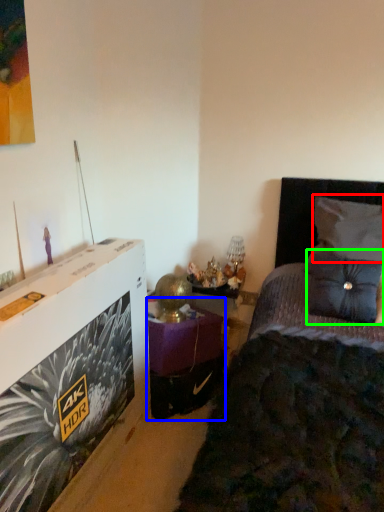
Question: Which object is the farthest from pillow (highlighted by a red box)? Choose among these: table (highlighted by a blue box) or pillow (highlighted by a green box).

Choices:
 (A) table
 (B) pillow

Answer: (A)